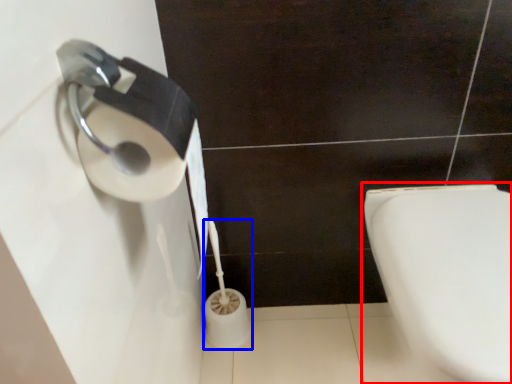
Question: Which point is further to the camera, toilet (highlighted by a red box) or toilet paper (highlighted by a blue box)?

Choices:
 (A) toilet
 (B) toilet paper

Answer: (B)